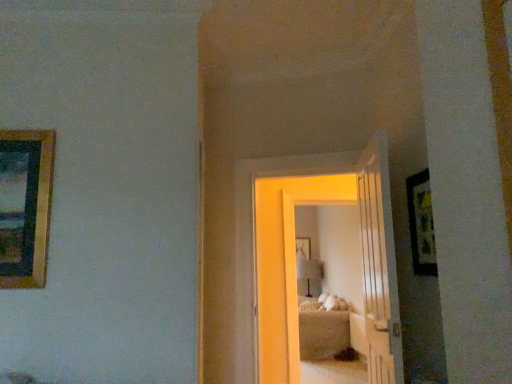
Question: Is wooden picture frame at center, marked as the 1th picture frame in a back-to-front arrangement, positioned with its back to wooden framed picture at right, the second picture frame viewed from the right?

Choices:
 (A) yes
 (B) no

Answer: (B)

Question: Could you tell me if wooden picture frame at center, marked as the 1th picture frame in a back-to-front arrangement, is turned towards wooden framed picture at right, acting as the second picture frame starting from the top?

Choices:
 (A) no
 (B) yes

Answer: (B)

Question: Considering the relative sizes of wooden picture frame at center, the 1th picture frame from the right, and wooden framed picture at right, the 1th picture frame viewed from the front, in the image provided, is wooden picture frame at center, the 1th picture frame from the right, smaller than wooden framed picture at right, the 1th picture frame viewed from the front,?

Choices:
 (A) yes
 (B) no

Answer: (B)

Question: Would you say wooden picture frame at center, which ranks as the third picture frame in top-to-bottom order, contains wooden framed picture at right, acting as the second picture frame starting from the top?

Choices:
 (A) yes
 (B) no

Answer: (B)

Question: Is wooden picture frame at center, the 1th picture frame from the right, touching wooden framed picture at right, arranged as the 2th picture frame when viewed from the left?

Choices:
 (A) yes
 (B) no

Answer: (B)

Question: Looking at the image, does matte white lamp at center seem bigger or smaller compared to wooden picture frame at center, which ranks as the third picture frame in top-to-bottom order?

Choices:
 (A) small
 (B) big

Answer: (B)

Question: From the image's perspective, is matte white lamp at center above or below wooden picture frame at center, which ranks as the third picture frame in top-to-bottom order?

Choices:
 (A) below
 (B) above

Answer: (A)

Question: From a real-world perspective, is matte white lamp at center positioned above or below wooden picture frame at center, acting as the 3th picture frame starting from the front?

Choices:
 (A) below
 (B) above

Answer: (A)

Question: Based on their positions, is matte white lamp at center located to the left or right of wooden picture frame at center, which ranks as the third picture frame in top-to-bottom order?

Choices:
 (A) left
 (B) right

Answer: (B)

Question: Choose the correct answer: Is gold-framed picture at left, the third picture frame when ordered from bottom to top, inside wooden framed picture at right, acting as the second picture frame starting from the top, or outside it?

Choices:
 (A) outside
 (B) inside

Answer: (A)

Question: In the image, is gold-framed picture at left, the second picture frame in the front-to-back sequence, positioned in front of or behind wooden framed picture at right, which ranks as the second picture frame in bottom-to-top order?

Choices:
 (A) front
 (B) behind

Answer: (B)

Question: From their relative heights in the image, would you say gold-framed picture at left, placed as the second picture frame when sorted from back to front, is taller or shorter than wooden framed picture at right, which ranks as the third picture frame in back-to-front order?

Choices:
 (A) short
 (B) tall

Answer: (B)

Question: Considering the positions of point (27, 251) and point (411, 178), is point (27, 251) closer or farther from the camera than point (411, 178)?

Choices:
 (A) farther
 (B) closer

Answer: (B)

Question: Considering the positions of point (423, 264) and point (35, 135), is point (423, 264) closer or farther from the camera than point (35, 135)?

Choices:
 (A) farther
 (B) closer

Answer: (A)

Question: Is wooden framed picture at right, the second picture frame viewed from the right, inside or outside of gold-framed picture at left, placed as the second picture frame when sorted from back to front?

Choices:
 (A) outside
 (B) inside

Answer: (A)